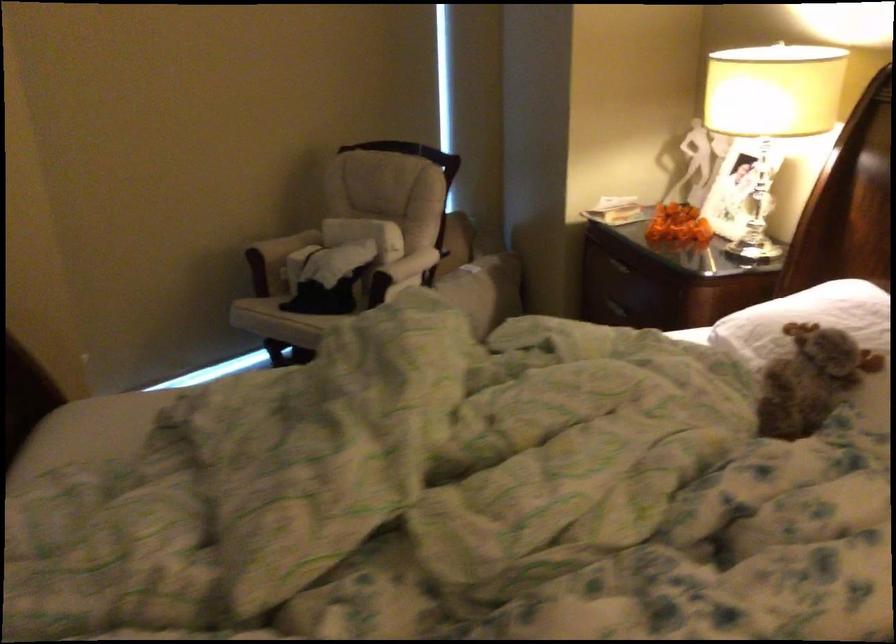
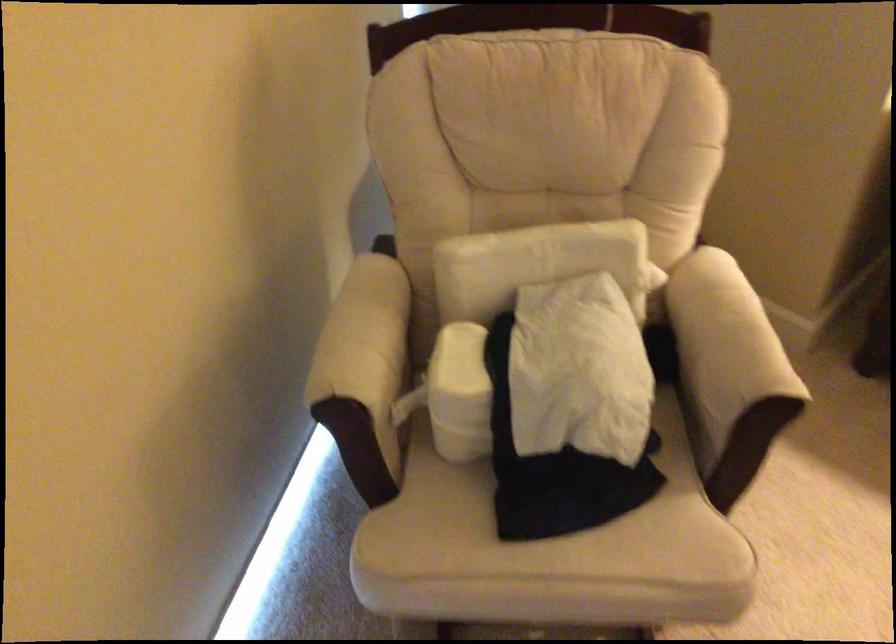
Find the pixel in the second image that matches (x=291, y=257) in the first image.

(460, 393)